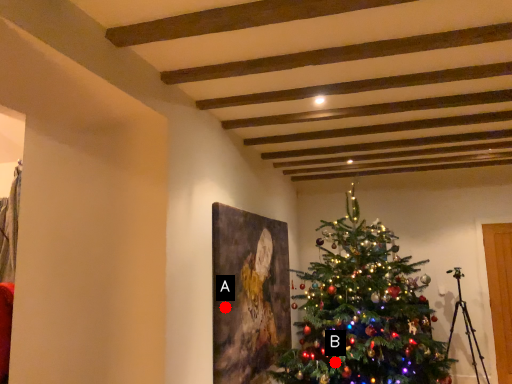
Question: Two points are circled on the image, labeled by A and B beside each circle. Which point is farther to the camera?

Choices:
 (A) A is further
 (B) B is further

Answer: (B)